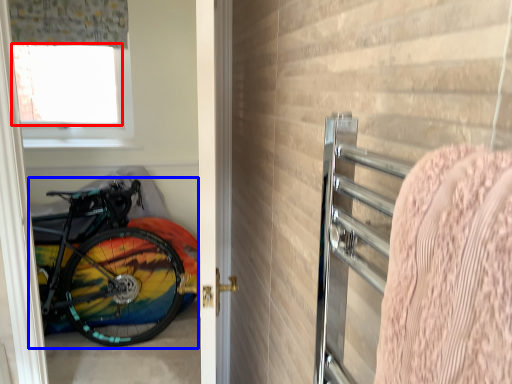
Question: Which point is further to the camera, window screen (highlighted by a red box) or bicycle (highlighted by a blue box)?

Choices:
 (A) window screen
 (B) bicycle

Answer: (A)